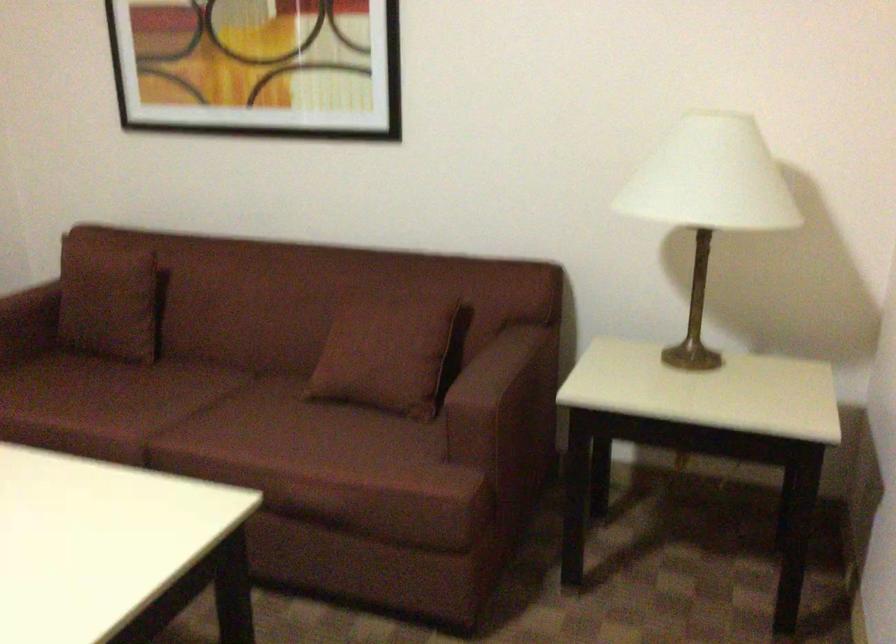
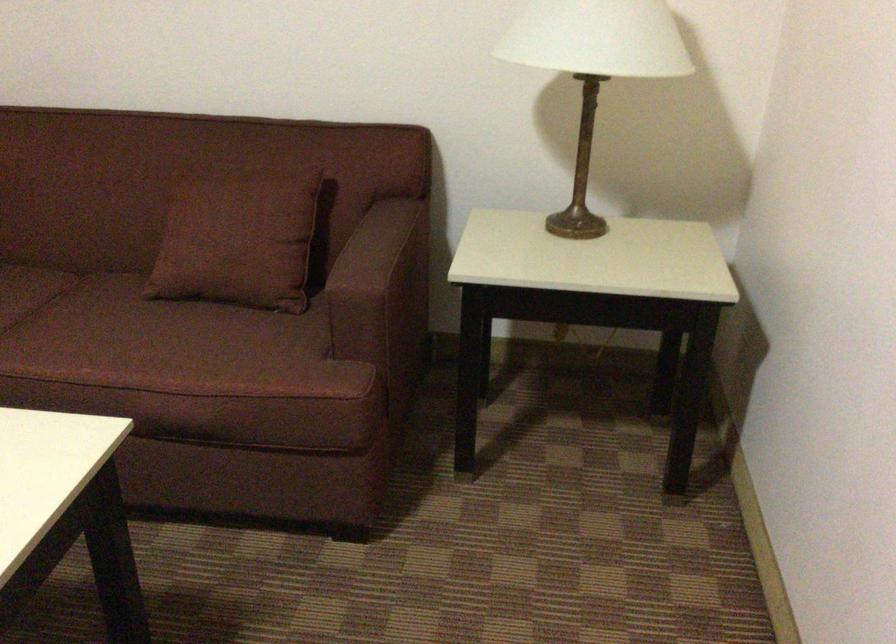
Find the pixel in the second image that matches (x=383, y=348) in the first image.

(238, 234)